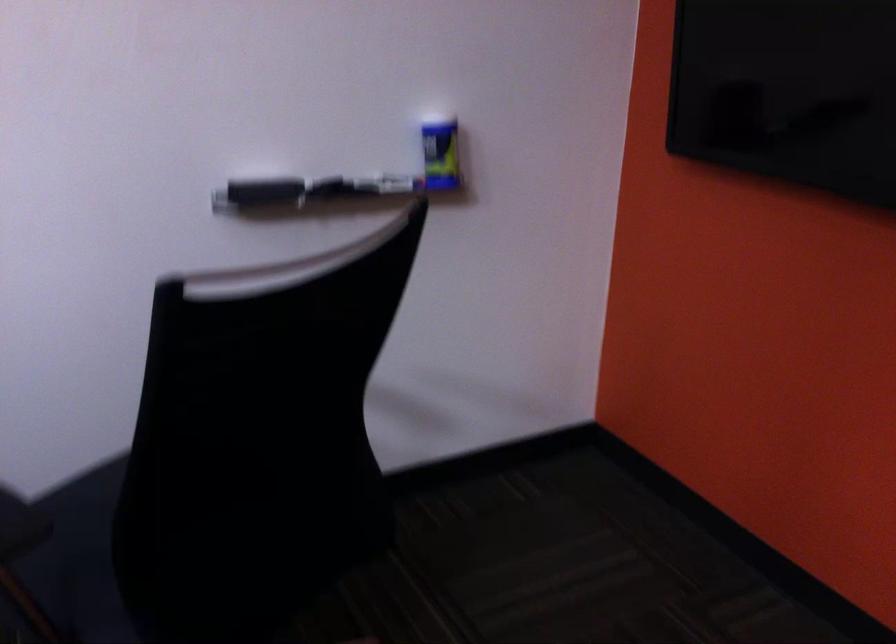
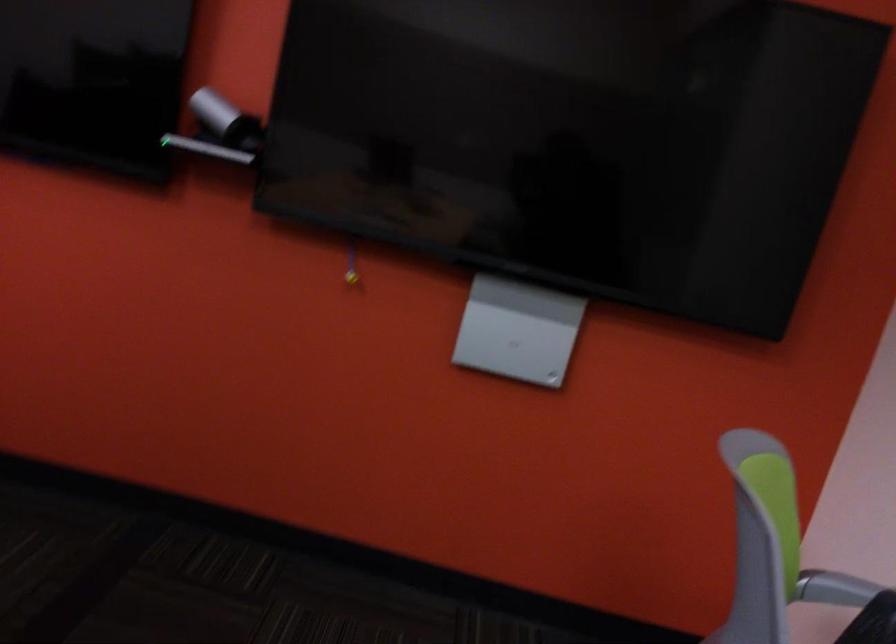
Question: The camera is either moving clockwise (left) or counter-clockwise (right) around the object. The first image is from the beginning of the video and the second image is from the end. Is the camera moving left or right when shooting the video?

Choices:
 (A) Left
 (B) Right

Answer: (A)